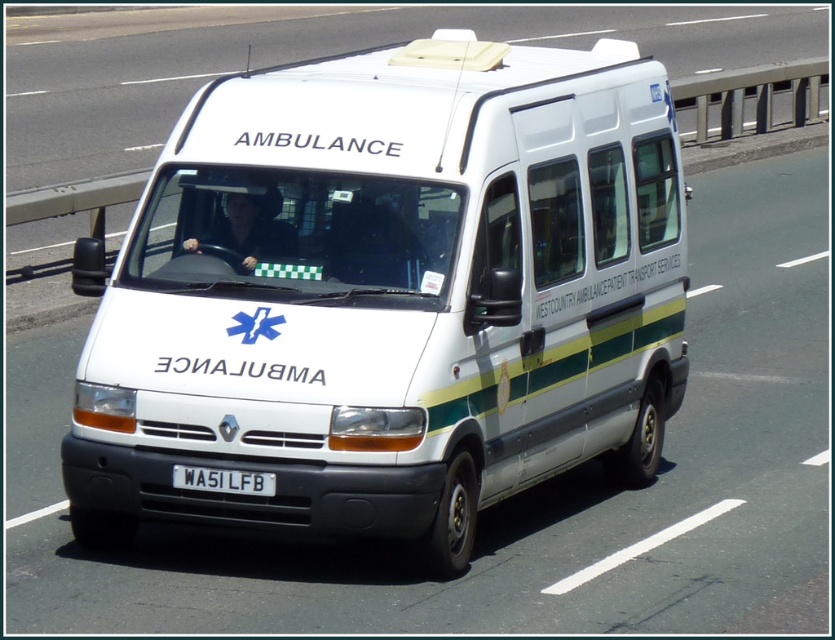
You are a traffic officer observing a white matte ambulance at center with a white plastic license plate at center. Which object is bigger?

The white matte ambulance at center is larger in size compared to the white plastic license plate at center.

You are a GPS system guiding a driver to an emergency location. The driver needs to identify the ambulance at the center of the image. What are the coordinates of the white matte ambulance at center?

The white matte ambulance at center is located at point (388, 296).

You are a traffic officer observing a white matte ambulance at center and a white plastic license plate at center. Which object is located to the right of the other?

The white matte ambulance at center is positioned on the right side of white plastic license plate at center.